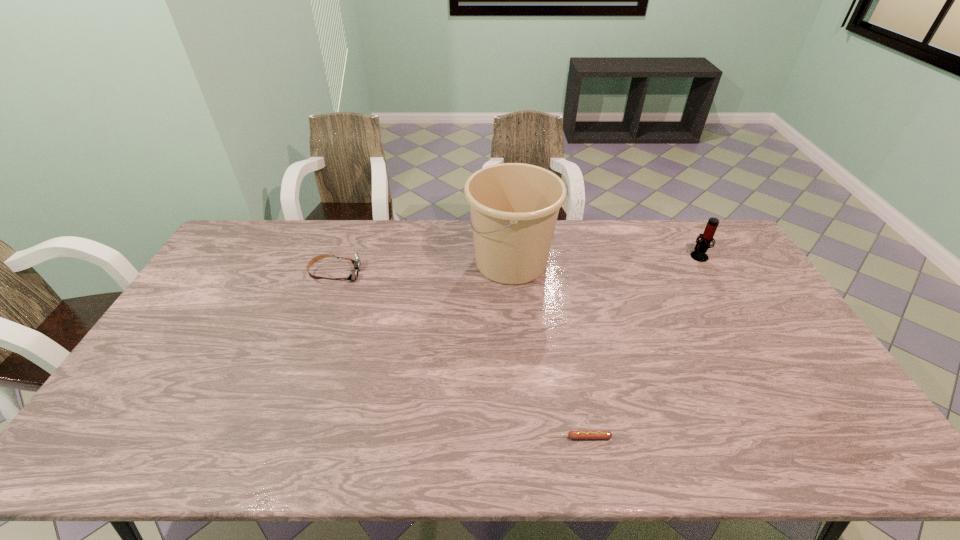
Locate an element on the screen. The image size is (960, 540). vacant space situated 0.330m on the right of the shortest object is located at coordinates (749, 437).

Where is `bucket situated at the far edge`? bucket situated at the far edge is located at coordinates (514, 207).

What are the coordinates of `microphone that is at the far edge` in the screenshot? It's located at (702, 245).

Where is `object located at the near edge`? The image size is (960, 540). object located at the near edge is located at coordinates (571, 434).

Locate an element on the screen. This screenshot has width=960, height=540. object present at the right edge is located at coordinates (702, 245).

Identify the location of object that is at the far right corner. The image size is (960, 540). tap(702, 245).

Find the location of a particular element. This screenshot has width=960, height=540. vacant area at the far edge of the desktop is located at coordinates (575, 235).

Identify the location of free space at the near edge. (699, 457).

The image size is (960, 540). In order to click on vacant area at the left edge of the desktop in this screenshot , I will do `click(230, 269)`.

Where is `free space at the right edge of the desktop`? The height and width of the screenshot is (540, 960). free space at the right edge of the desktop is located at coordinates (712, 267).